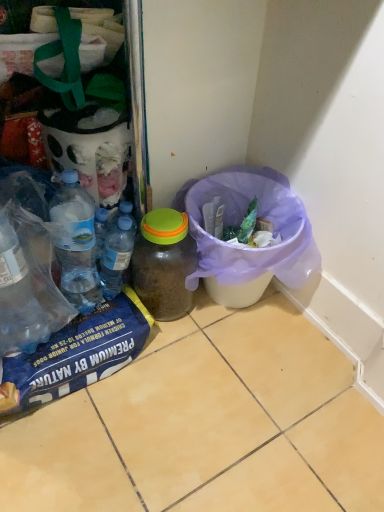
Question: Would you consider purple fabric bag at lower right to be distant from translucent plastic bottles at center, which ranks as the 2th bottle in right-to-left order?

Choices:
 (A) yes
 (B) no

Answer: (B)

Question: Can you confirm if purple fabric bag at lower right is bigger than translucent plastic bottles at center, which ranks as the 2th bottle in right-to-left order?

Choices:
 (A) yes
 (B) no

Answer: (A)

Question: Does purple fabric bag at lower right have a greater width compared to translucent plastic bottles at center, which ranks as the first bottle in left-to-right order?

Choices:
 (A) yes
 (B) no

Answer: (A)

Question: Is translucent plastic bottles at center, which ranks as the 2th bottle in right-to-left order, surrounded by purple fabric bag at lower right?

Choices:
 (A) no
 (B) yes

Answer: (A)

Question: From the image's perspective, is purple fabric bag at lower right under translucent plastic bottles at center, which ranks as the first bottle in left-to-right order?

Choices:
 (A) no
 (B) yes

Answer: (A)

Question: Considering the positions of point (218, 287) and point (145, 268), is point (218, 287) closer or farther from the camera than point (145, 268)?

Choices:
 (A) farther
 (B) closer

Answer: (A)

Question: Considering the positions of purple fabric bag at lower right and translucent plastic jar at center, positioned as the 2th bottle in left-to-right order, in the image, is purple fabric bag at lower right bigger or smaller than translucent plastic jar at center, positioned as the 2th bottle in left-to-right order,?

Choices:
 (A) big
 (B) small

Answer: (A)

Question: From the image's perspective, is purple fabric bag at lower right positioned above or below translucent plastic jar at center, acting as the first bottle starting from the right?

Choices:
 (A) below
 (B) above

Answer: (B)

Question: Looking at their shapes, would you say purple fabric bag at lower right is wider or thinner than translucent plastic jar at center, positioned as the 2th bottle in left-to-right order?

Choices:
 (A) thin
 (B) wide

Answer: (B)

Question: Is translucent plastic bottles at center, which ranks as the first bottle in left-to-right order, inside the boundaries of purple fabric bag at lower right, or outside?

Choices:
 (A) outside
 (B) inside

Answer: (A)

Question: From the image's perspective, relative to purple fabric bag at lower right, is translucent plastic bottles at center, which ranks as the 2th bottle in right-to-left order, above or below?

Choices:
 (A) above
 (B) below

Answer: (B)

Question: Is translucent plastic bottles at center, which ranks as the 2th bottle in right-to-left order, in front of or behind purple fabric bag at lower right in the image?

Choices:
 (A) front
 (B) behind

Answer: (B)

Question: Looking at the image, does translucent plastic bottles at center, which ranks as the 2th bottle in right-to-left order, seem bigger or smaller compared to purple fabric bag at lower right?

Choices:
 (A) big
 (B) small

Answer: (B)

Question: In terms of size, does translucent plastic jar at center, acting as the first bottle starting from the right, appear bigger or smaller than purple fabric bag at lower right?

Choices:
 (A) big
 (B) small

Answer: (B)

Question: Is translucent plastic jar at center, acting as the first bottle starting from the right, situated inside purple fabric bag at lower right or outside?

Choices:
 (A) outside
 (B) inside

Answer: (A)